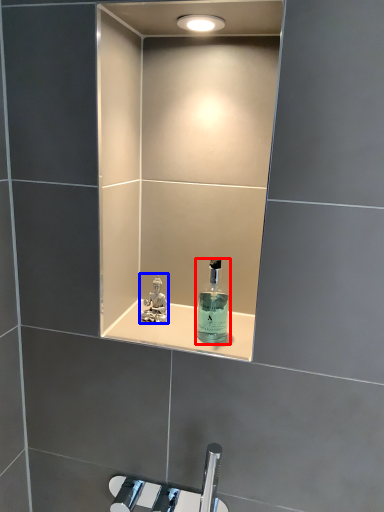
Question: Which object appears closest to the camera in this image, bottle (highlighted by a red box) or perfume (highlighted by a blue box)?

Choices:
 (A) bottle
 (B) perfume

Answer: (A)